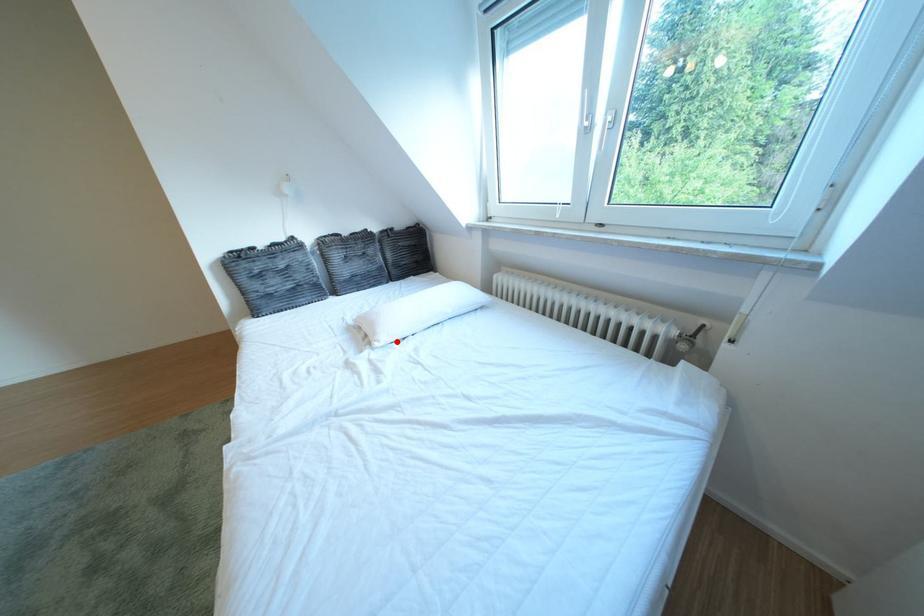
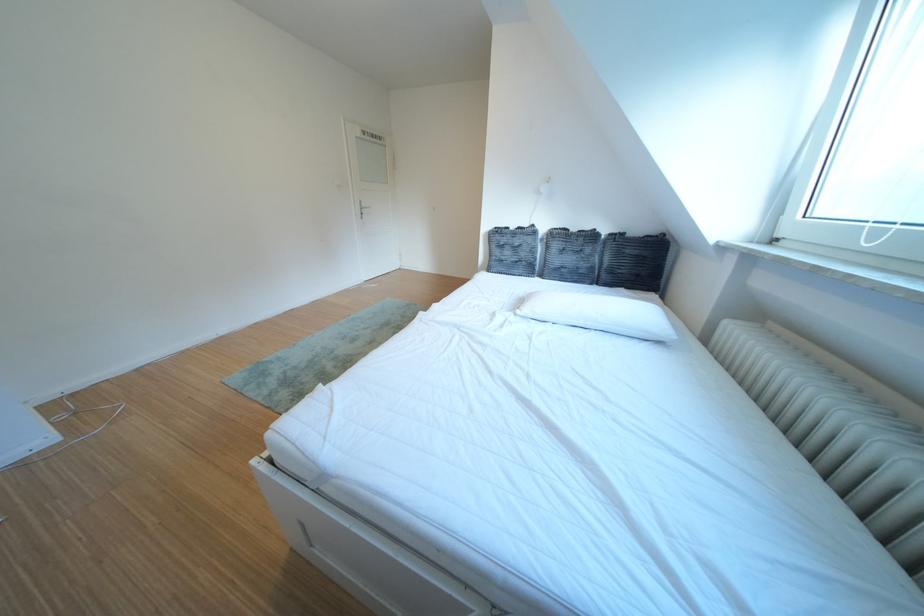
Locate, in the second image, the point that corresponds to the highlighted location in the first image.

(540, 314)